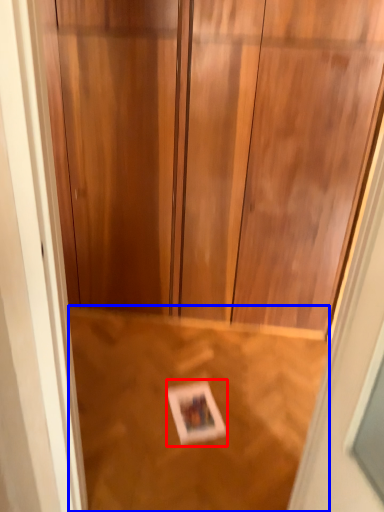
Question: Which of the following is the closest to the observer, postcard (highlighted by a red box) or plywood (highlighted by a blue box)?

Choices:
 (A) postcard
 (B) plywood

Answer: (B)